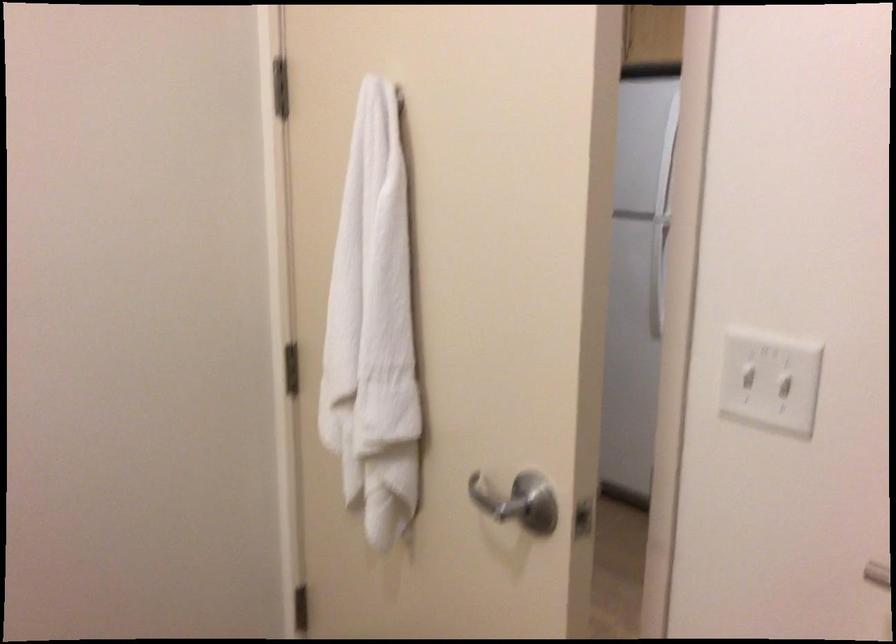
This screenshot has height=644, width=896. I want to click on refrigerator door handle, so click(661, 220).